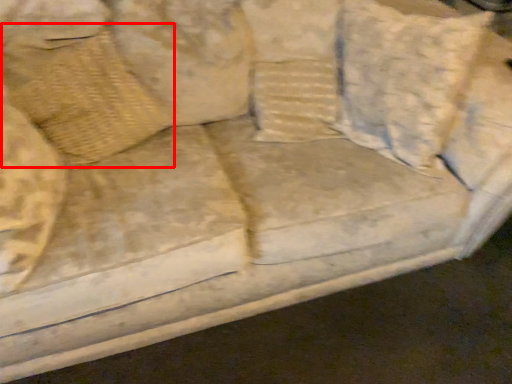
Question: From the image's perspective, what is the correct spatial positioning of pillow (annotated by the red box) in reference to pillow?

Choices:
 (A) below
 (B) above

Answer: (A)